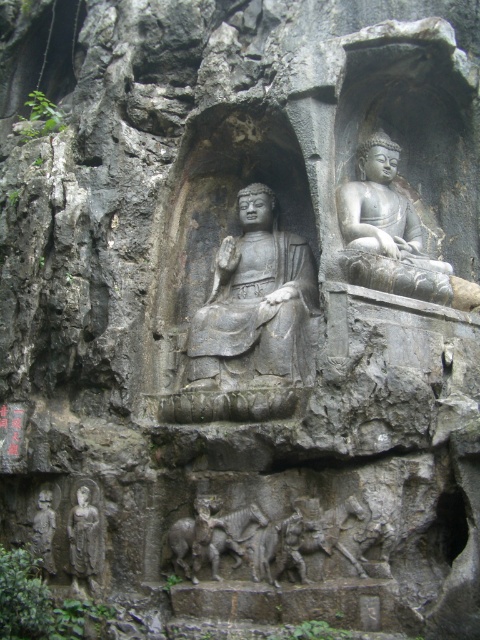
Question: Which object is farther from the camera taking this photo?

Choices:
 (A) gray stone statue at center
 (B) dark gray stone relief at center
 (C) gray stone buddha at upper center
 (D) gray stone statue at lower left

Answer: (A)

Question: Which object is positioned closest to the dark gray stone relief at center?

Choices:
 (A) gray stone buddha at upper center
 (B) gray stone statue at center

Answer: (B)

Question: Does gray stone buddha at upper center come in front of gray stone statue at lower left?

Choices:
 (A) yes
 (B) no

Answer: (B)

Question: Which point is farther to the camera?

Choices:
 (A) gray stone statue at lower left
 (B) gray stone buddha at upper center
 (C) gray stone statue at center

Answer: (C)

Question: Is gray stone statue at center positioned behind dark gray stone relief at center?

Choices:
 (A) yes
 (B) no

Answer: (A)

Question: Can you confirm if gray stone buddha at upper center is smaller than gray stone statue at lower left?

Choices:
 (A) no
 (B) yes

Answer: (A)